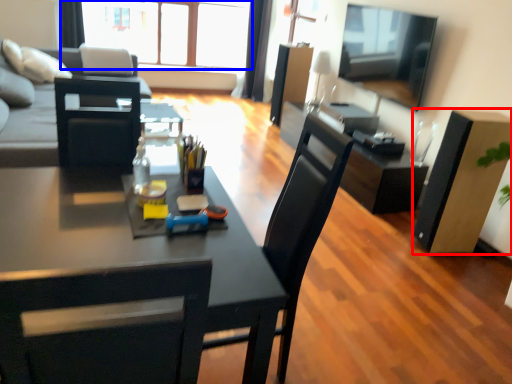
Question: Which object appears closest to the camera in this image, box (highlighted by a red box) or window (highlighted by a blue box)?

Choices:
 (A) box
 (B) window

Answer: (A)